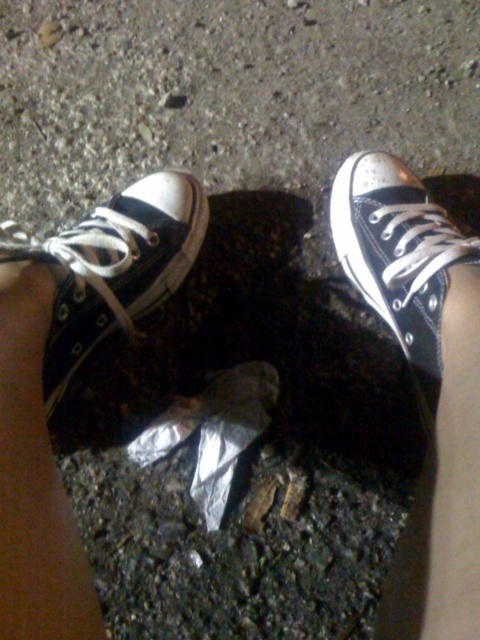
You are a delivery robot that needs to move a package from the matte canvas sneaker at lower left to the matte black sneaker at upper right. The robot has a maximum reach of 12 inches. Can the robot reach the destination without moving?

The distance between the matte canvas sneaker at lower left and the matte black sneaker at upper right is 13.24 inches, which exceeds the robot s 12 inch reach. Therefore, the robot cannot reach the destination without moving.

You are a photographer trying to capture both the matte canvas sneaker at lower left and the matte black sneaker at upper right in a single focused shot. Which sneaker will appear more in focus if you focus on the one closer to you?

The matte canvas sneaker at lower left is closer to the viewer than the matte black sneaker at upper right, so focusing on the closer one will make the matte canvas sneaker at lower left appear more in focus.